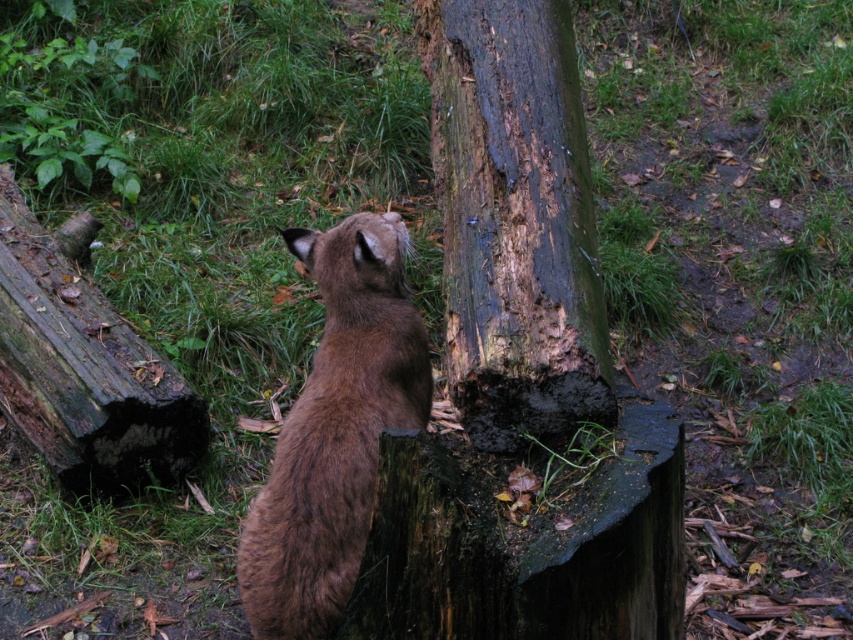
Question: Is dark brown wood at center wider than brown furry cat at center?

Choices:
 (A) yes
 (B) no

Answer: (A)

Question: Does dark brown wood at center appear on the left side of brown furry cat at center?

Choices:
 (A) no
 (B) yes

Answer: (A)

Question: Does dark brown wood at center have a lesser width compared to brown furry cat at center?

Choices:
 (A) no
 (B) yes

Answer: (A)

Question: Among these points, which one is farthest from the camera?

Choices:
 (A) (250, 540)
 (B) (451, 381)

Answer: (A)